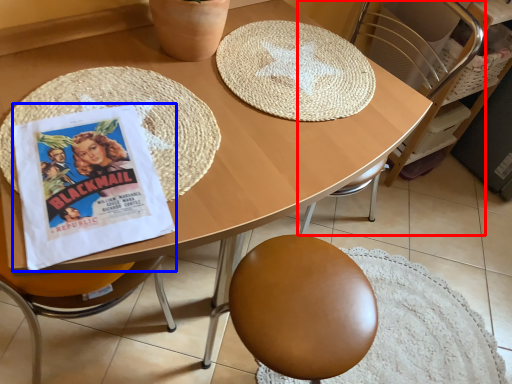
Question: Among these objects, which one is nearest to the camera, chair (highlighted by a red box) or comic book (highlighted by a blue box)?

Choices:
 (A) chair
 (B) comic book

Answer: (B)